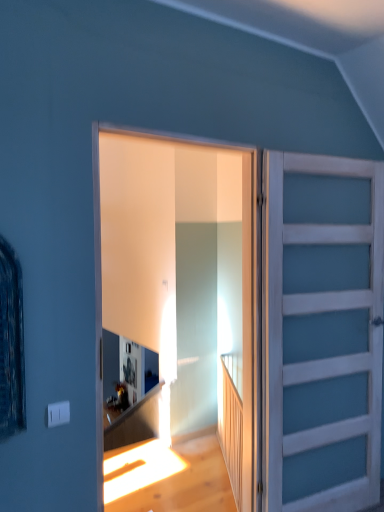
Describe the element at coordinates (321, 332) in the screenshot. Image resolution: width=384 pixels, height=512 pixels. I see `white painted wood door at right, the 1th door from the right` at that location.

What is the approximate width of wooden at right?

The width of wooden at right is 3.94 inches.

Where is `translucent glass door at center, which is counted as the 1th door, starting from the left`? The image size is (384, 512). translucent glass door at center, which is counted as the 1th door, starting from the left is located at coordinates (294, 293).

Is white painted wood door at right, the 2th door when ordered from left to right, aimed at translucent glass door at center, which is counted as the 1th door, starting from the left?

No, white painted wood door at right, the 2th door when ordered from left to right, is not turned towards translucent glass door at center, which is counted as the 1th door, starting from the left.

Which is behind, white painted wood door at right, the 1th door from the right, or translucent glass door at center, which is counted as the 1th door, starting from the left?

white painted wood door at right, the 1th door from the right, is behind.

Based on the photo, from a real-world perspective, is white painted wood door at right, the 2th door when ordered from left to right, over translucent glass door at center, marked as the second door in a right-to-left arrangement?

No, from a real-world perspective, white painted wood door at right, the 2th door when ordered from left to right, is not over translucent glass door at center, marked as the second door in a right-to-left arrangement

Does white painted wood door at right, the 2th door when ordered from left to right, have a greater height compared to translucent glass door at center, which is counted as the 1th door, starting from the left?

Yes, white painted wood door at right, the 2th door when ordered from left to right, is taller than translucent glass door at center, which is counted as the 1th door, starting from the left.

Which point is more distant from viewer, (x=227, y=426) or (x=338, y=167)?

The point (x=227, y=426) is farther from the camera.

Based on the photo, does wooden at right lie behind translucent glass door at center, which is counted as the 1th door, starting from the left?

Yes, it is behind translucent glass door at center, which is counted as the 1th door, starting from the left.

From the picture: Is wooden at right far away from translucent glass door at center, which is counted as the 1th door, starting from the left?

That's not correct — wooden at right is a little close to translucent glass door at center, which is counted as the 1th door, starting from the left.

Is white painted wood door at right, the 1th door from the right, facing away from wooden at right?

Correct, white painted wood door at right, the 1th door from the right, is looking away from wooden at right.

Is white painted wood door at right, the 1th door from the right, next to wooden at right and touching it?

There is a gap between white painted wood door at right, the 1th door from the right, and wooden at right.

From a real-world perspective, is white painted wood door at right, the 1th door from the right, over wooden at right?

Correct, in the physical world, white painted wood door at right, the 1th door from the right, is higher than wooden at right.

Consider the image. Which is in front, white painted wood door at right, the 2th door when ordered from left to right, or wooden at right?

white painted wood door at right, the 2th door when ordered from left to right.

At what (x,y) coordinates should I click in order to perform the action: click on stairwell behind the white painted wood door at right, the 1th door from the right. Please return your answer as a coordinate pair (x, y). Looking at the image, I should click on (231, 425).

From the image's perspective, who appears lower, wooden at right or white painted wood door at right, the 2th door when ordered from left to right?

wooden at right.

Is wooden at right situated inside white painted wood door at right, the 2th door when ordered from left to right, or outside?

wooden at right is spatially situated outside white painted wood door at right, the 2th door when ordered from left to right.

Is wooden at right to the left of white painted wood door at right, the 1th door from the right, from the viewer's perspective?

Indeed, wooden at right is positioned on the left side of white painted wood door at right, the 1th door from the right.

From the image's perspective, is translucent glass door at center, which is counted as the 1th door, starting from the left, beneath wooden at right?

No, from the image's perspective, translucent glass door at center, which is counted as the 1th door, starting from the left, is not below wooden at right.

Which of these two, translucent glass door at center, which is counted as the 1th door, starting from the left, or wooden at right, is thinner?

wooden at right is thinner.

Considering the positions of points (246, 212) and (223, 354), is point (246, 212) farther from camera compared to point (223, 354)?

No, (246, 212) is in front of (223, 354).

From a real-world perspective, relative to white painted wood door at right, the 2th door when ordered from left to right, is translucent glass door at center, marked as the second door in a right-to-left arrangement, vertically above or below?

translucent glass door at center, marked as the second door in a right-to-left arrangement, is above white painted wood door at right, the 2th door when ordered from left to right.

Is translucent glass door at center, which is counted as the 1th door, starting from the left, positioned in front of white painted wood door at right, the 2th door when ordered from left to right?

That is True.

Is translucent glass door at center, marked as the second door in a right-to-left arrangement, not close to white painted wood door at right, the 2th door when ordered from left to right?

No, translucent glass door at center, marked as the second door in a right-to-left arrangement, is not far from white painted wood door at right, the 2th door when ordered from left to right.

Where is `door above the white painted wood door at right, the 2th door when ordered from left to right (from the image's perspective)`? The height and width of the screenshot is (512, 384). door above the white painted wood door at right, the 2th door when ordered from left to right (from the image's perspective) is located at coordinates (294, 293).

This screenshot has width=384, height=512. Identify the location of stairwell lying behind the translucent glass door at center, which is counted as the 1th door, starting from the left. (231, 425).

Based on their spatial positions, is translucent glass door at center, which is counted as the 1th door, starting from the left, or wooden at right further from white painted wood door at right, the 2th door when ordered from left to right?

Among the two, wooden at right is located further to white painted wood door at right, the 2th door when ordered from left to right.

From the image, which object appears to be farther from wooden at right, translucent glass door at center, marked as the second door in a right-to-left arrangement, or white painted wood door at right, the 1th door from the right?

white painted wood door at right, the 1th door from the right, is positioned further to the anchor wooden at right.

Based on their spatial positions, is wooden at right or white painted wood door at right, the 2th door when ordered from left to right, closer to translucent glass door at center, marked as the second door in a right-to-left arrangement?

Based on the image, white painted wood door at right, the 2th door when ordered from left to right, appears to be nearer to translucent glass door at center, marked as the second door in a right-to-left arrangement.

Considering their positions, is white painted wood door at right, the 1th door from the right, positioned closer to wooden at right than translucent glass door at center, marked as the second door in a right-to-left arrangement?

The object closer to wooden at right is translucent glass door at center, marked as the second door in a right-to-left arrangement.

Which object lies further to the anchor point white painted wood door at right, the 2th door when ordered from left to right, wooden at right or translucent glass door at center, marked as the second door in a right-to-left arrangement?

wooden at right is further to white painted wood door at right, the 2th door when ordered from left to right.

Which object lies further to the anchor point translucent glass door at center, which is counted as the 1th door, starting from the left, white painted wood door at right, the 2th door when ordered from left to right, or wooden at right?

Among the two, wooden at right is located further to translucent glass door at center, which is counted as the 1th door, starting from the left.

The height and width of the screenshot is (512, 384). Find the location of `stairwell between translucent glass door at center, which is counted as the 1th door, starting from the left, and white painted wood door at right, the 1th door from the right`. stairwell between translucent glass door at center, which is counted as the 1th door, starting from the left, and white painted wood door at right, the 1th door from the right is located at coordinates (231, 425).